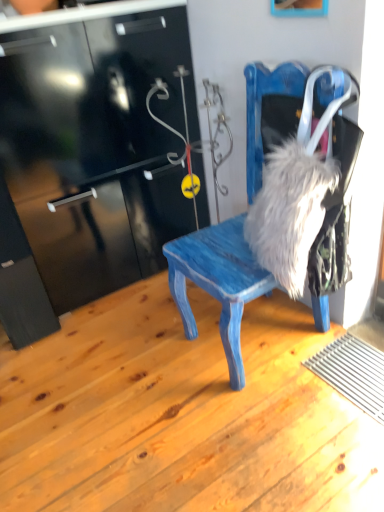
Question: Is wooden picture frame at upper center inside the boundaries of fuzzy gray fur at right, or outside?

Choices:
 (A) outside
 (B) inside

Answer: (A)

Question: Is point (291, 5) closer or farther from the camera than point (284, 201)?

Choices:
 (A) farther
 (B) closer

Answer: (A)

Question: Which is nearer to the blue painted wood chair at center?

Choices:
 (A) wooden picture frame at upper center
 (B) fuzzy gray fur at right

Answer: (B)

Question: Which object is the farthest from the blue painted wood chair at center?

Choices:
 (A) fuzzy gray fur at right
 (B) wooden picture frame at upper center

Answer: (B)